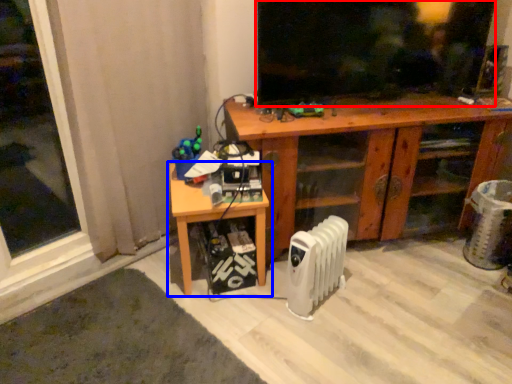
Question: Which of the following is the closest to the observer, window screen (highlighted by a red box) or table (highlighted by a blue box)?

Choices:
 (A) window screen
 (B) table

Answer: (B)